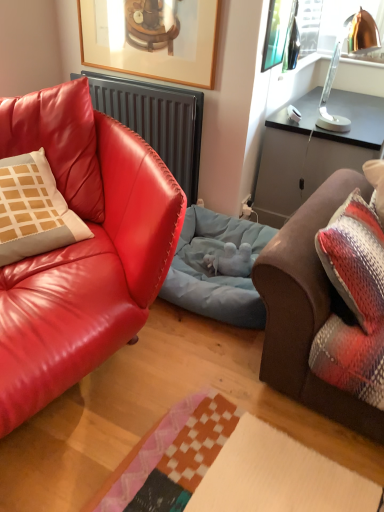
Question: Does copper metallic lamp at upper right turn towards light blue fabric dog bed at center?

Choices:
 (A) no
 (B) yes

Answer: (A)

Question: Considering the relative positions of copper metallic lamp at upper right and light blue fabric dog bed at center in the image provided, is copper metallic lamp at upper right to the left of light blue fabric dog bed at center from the viewer's perspective?

Choices:
 (A) yes
 (B) no

Answer: (B)

Question: Is copper metallic lamp at upper right wider than light blue fabric dog bed at center?

Choices:
 (A) yes
 (B) no

Answer: (B)

Question: Does copper metallic lamp at upper right have a greater height compared to light blue fabric dog bed at center?

Choices:
 (A) no
 (B) yes

Answer: (B)

Question: Can you confirm if copper metallic lamp at upper right is thinner than light blue fabric dog bed at center?

Choices:
 (A) yes
 (B) no

Answer: (A)

Question: Is copper metallic lamp at upper right far away from light blue fabric dog bed at center?

Choices:
 (A) yes
 (B) no

Answer: (A)

Question: Is matte black radiator at left far away from copper metallic lamp at upper right?

Choices:
 (A) yes
 (B) no

Answer: (A)

Question: Does matte black radiator at left come behind copper metallic lamp at upper right?

Choices:
 (A) yes
 (B) no

Answer: (A)

Question: Does matte black radiator at left have a greater width compared to copper metallic lamp at upper right?

Choices:
 (A) no
 (B) yes

Answer: (A)

Question: Can you see matte black radiator at left touching copper metallic lamp at upper right?

Choices:
 (A) no
 (B) yes

Answer: (A)

Question: Is matte black radiator at left positioned beyond the bounds of copper metallic lamp at upper right?

Choices:
 (A) yes
 (B) no

Answer: (A)

Question: Is matte black radiator at left bigger than copper metallic lamp at upper right?

Choices:
 (A) no
 (B) yes

Answer: (B)

Question: Is brown leather couch at right, which appears as the first studio couch when viewed from the right, at the right side of light blue fabric dog bed at center?

Choices:
 (A) yes
 (B) no

Answer: (A)